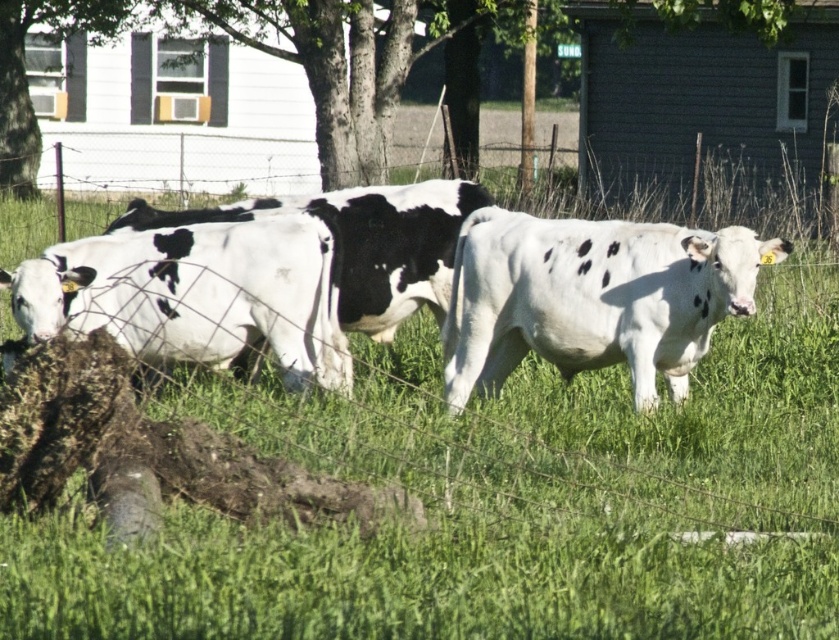
Can you confirm if green leafy tree at upper center is positioned to the right of white speckled cow at left?

Incorrect, green leafy tree at upper center is not on the right side of white speckled cow at left.

Does point (228, 16) come behind point (341, 356)?

Yes.

Does point (324, 124) come in front of point (149, 349)?

That is False.

Where is `green leafy tree at upper center`? The image size is (839, 640). green leafy tree at upper center is located at coordinates (258, 51).

Between point (725, 284) and point (13, 310), which one is positioned behind?

Point (13, 310)

Image resolution: width=839 pixels, height=640 pixels. Identify the location of white smooth cow at center. (592, 298).

Does white spotted cow at center have a lesser width compared to white speckled cow at left?

Incorrect, white spotted cow at center's width is not less than white speckled cow at left's.

Can you confirm if white spotted cow at center is taller than white speckled cow at left?

Correct, white spotted cow at center is much taller as white speckled cow at left.

Who is more forward, (x=421, y=275) or (x=178, y=291)?

Point (x=178, y=291) is in front.

Where is `white spotted cow at center`? The image size is (839, 640). white spotted cow at center is located at coordinates (569, 289).